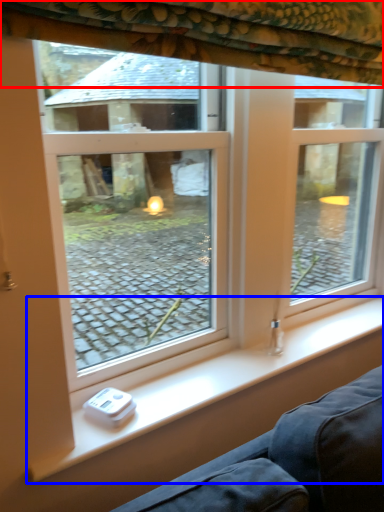
Question: Which of the following is the farthest to the observer, curtain (highlighted by a red box) or window sill (highlighted by a blue box)?

Choices:
 (A) curtain
 (B) window sill

Answer: (B)